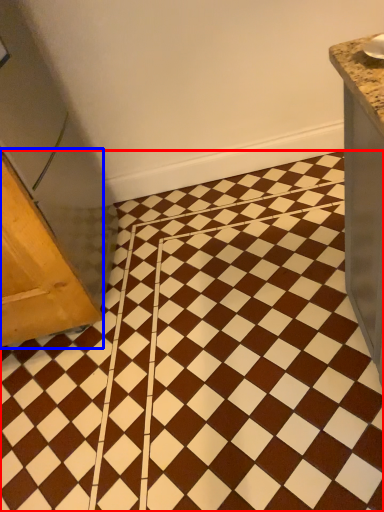
Question: Which point is closer to the camera, ceramic tile (highlighted by a red box) or furniture (highlighted by a blue box)?

Choices:
 (A) ceramic tile
 (B) furniture

Answer: (A)